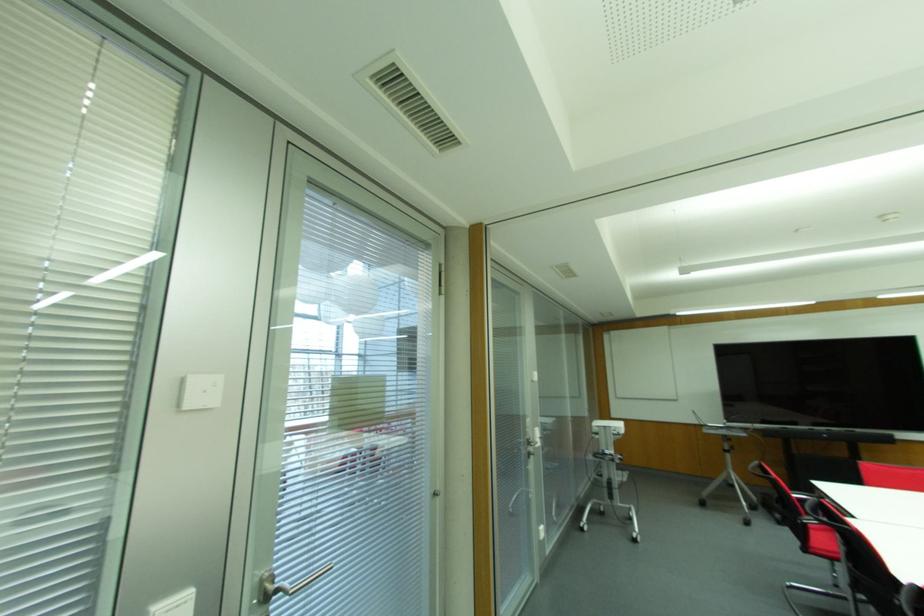
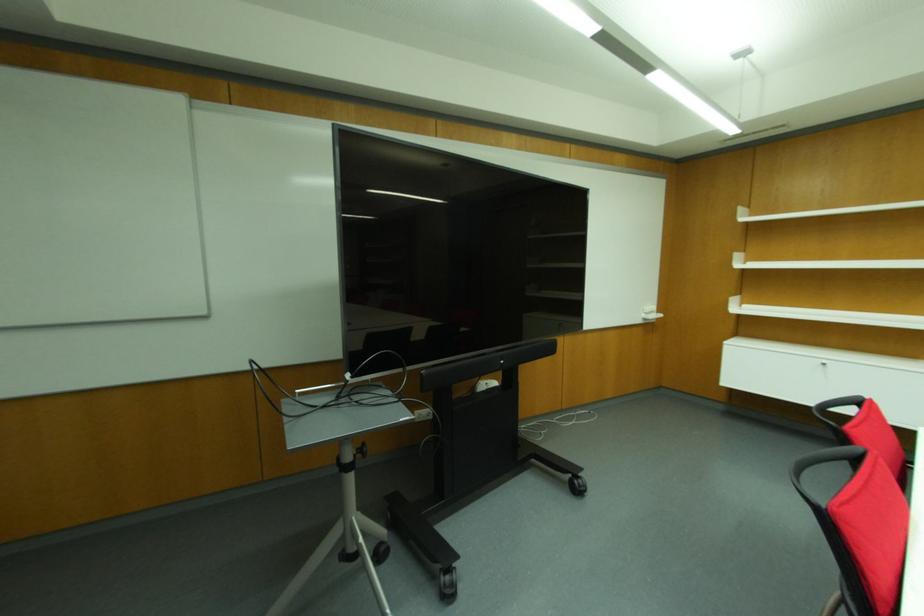
Find the pixel in the second image that matches (x=732, y=447) in the first image.

(360, 450)